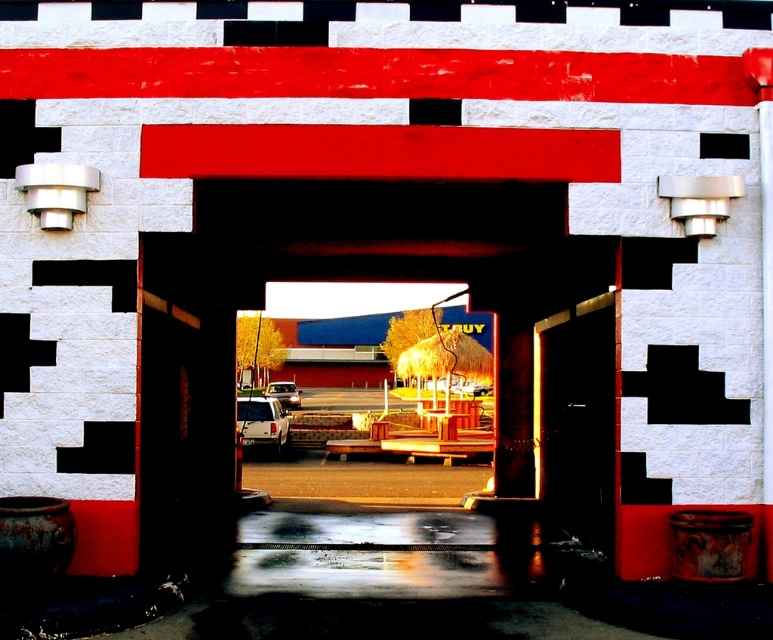
Question: Which point is farther to the camera?

Choices:
 (A) black rubber tire at center
 (B) metallic silver suv at center

Answer: (A)

Question: Observing the image, what is the correct spatial positioning of wooden door at center in reference to metallic silver suv at center?

Choices:
 (A) below
 (B) above

Answer: (B)

Question: Which object is closer to the camera taking this photo?

Choices:
 (A) black rubber tire at center
 (B) metallic silver suv at center
 (C) metallic silver car at center
 (D) wooden door at center

Answer: (D)

Question: Which point appears closest to the camera in this image?

Choices:
 (A) (540, 445)
 (B) (298, 403)
 (C) (244, 412)

Answer: (A)

Question: Is metallic silver suv at center to the left of black rubber tire at center from the viewer's perspective?

Choices:
 (A) yes
 (B) no

Answer: (A)

Question: Is wooden door at center to the right of metallic silver suv at center from the viewer's perspective?

Choices:
 (A) no
 (B) yes

Answer: (B)